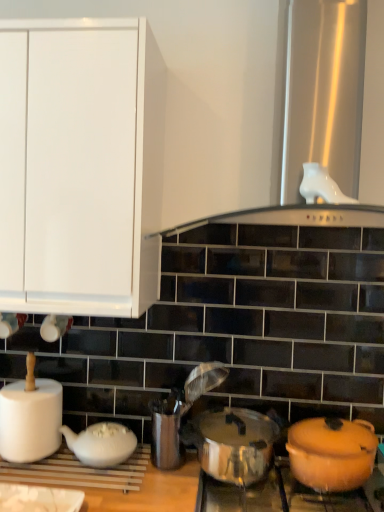
Question: From their relative heights in the image, would you say white matte teapot at lower left is taller or shorter than orange matte pot at lower right?

Choices:
 (A) tall
 (B) short

Answer: (B)

Question: From the image's perspective, is white matte teapot at lower left located above or below orange matte pot at lower right?

Choices:
 (A) below
 (B) above

Answer: (A)

Question: Estimate the real-world distances between objects in this image. Which object is farther from the metallic silver crock pot at center?

Choices:
 (A) white matte teapot at lower left
 (B) orange matte pot at lower right
 (C) shiny metallic pot at lower right
 (D) white matte paper towel at left
 (E) metallic silver utensil holder at center

Answer: (D)

Question: Which object is positioned closest to the orange matte pot at lower right?

Choices:
 (A) shiny metallic pot at lower right
 (B) metallic silver utensil holder at center
 (C) white matte paper towel at left
 (D) white matte teapot at lower left
 (E) metallic silver crock pot at center

Answer: (A)